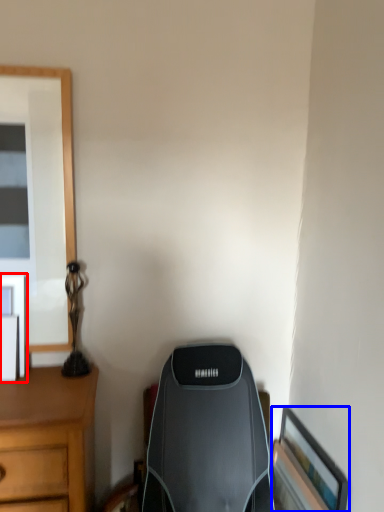
Question: Which object appears closest to the camera in this image, picture frame (highlighted by a red box) or picture frame (highlighted by a blue box)?

Choices:
 (A) picture frame
 (B) picture frame

Answer: (B)